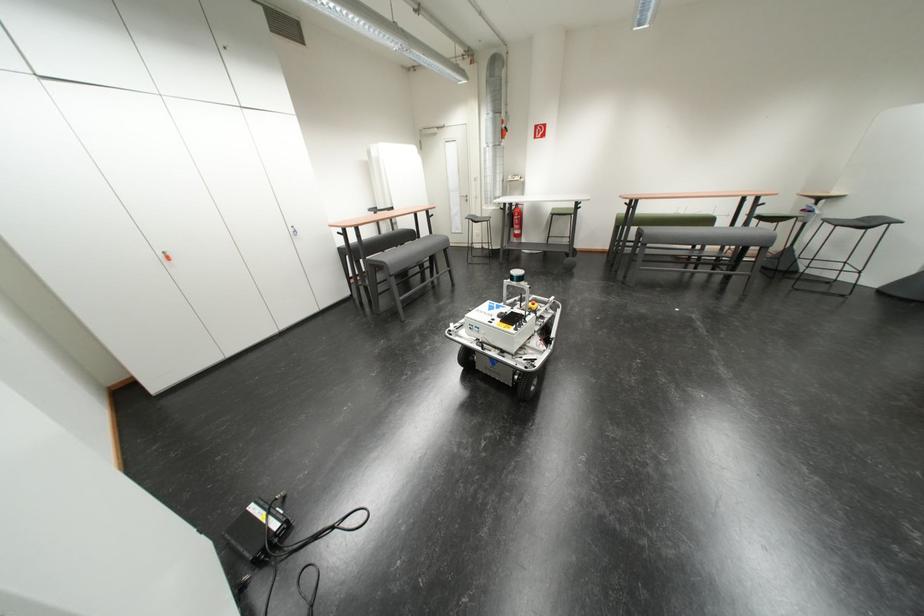
Where is `fire extinguisher handle`? Image resolution: width=924 pixels, height=616 pixels. fire extinguisher handle is located at coordinates (517, 209).